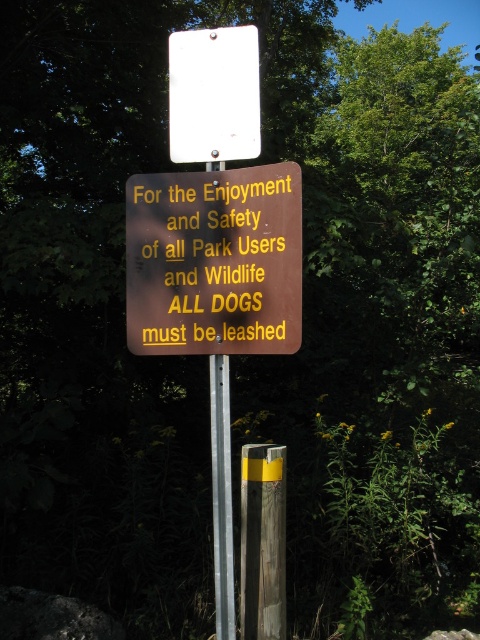
Where is the white paper at upper center located in the image?

The white paper at upper center is located at point (214, 96) in the image.

You are a park ranger checking the signs. You notice the white paper at upper center and the silver metallic pole at center. Which object is wider?

The white paper at upper center is wider than the silver metallic pole at center according to the description.

You are a hiker who wants to attach a note to the silver metallic pole at center. Where should you place it so it doesn not cover the white paper at upper center?

The white paper at upper center is located above the silver metallic pole at center, so you should place your note below the white paper at upper center to avoid covering it.